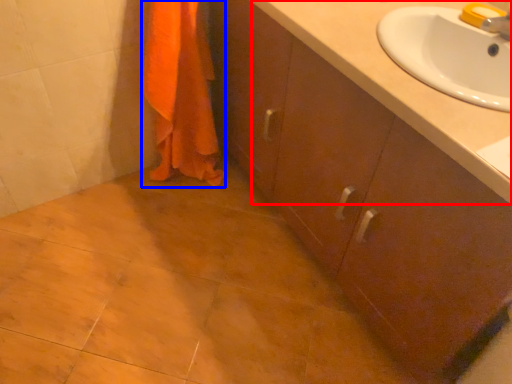
Question: Among these objects, which one is nearest to the camera, counter top (highlighted by a red box) or bath towel (highlighted by a blue box)?

Choices:
 (A) counter top
 (B) bath towel

Answer: (A)